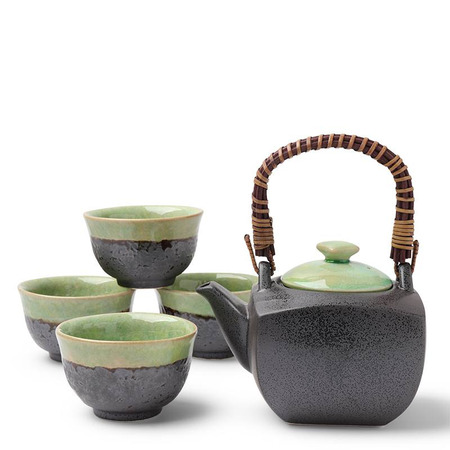
Identify the location of round handle. point(323,261).